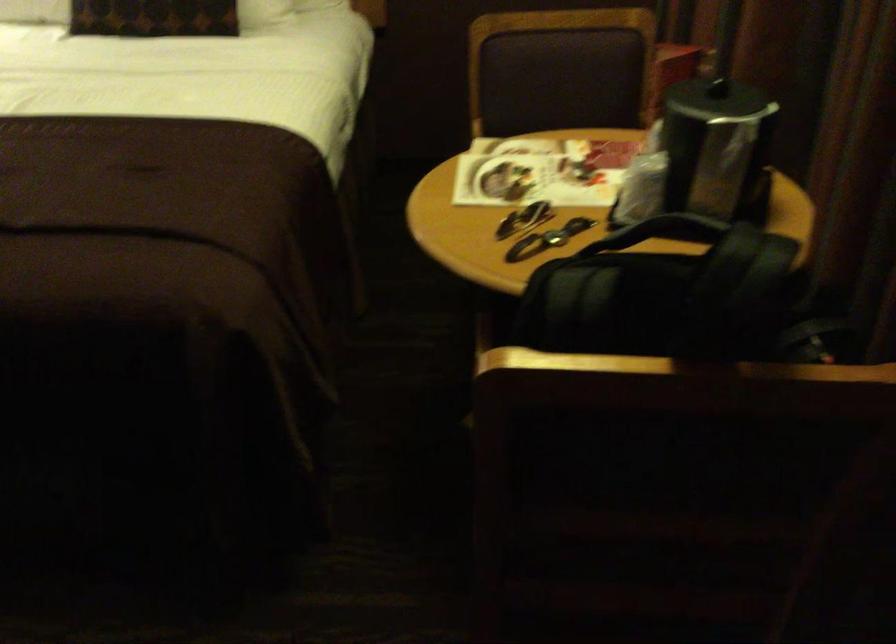
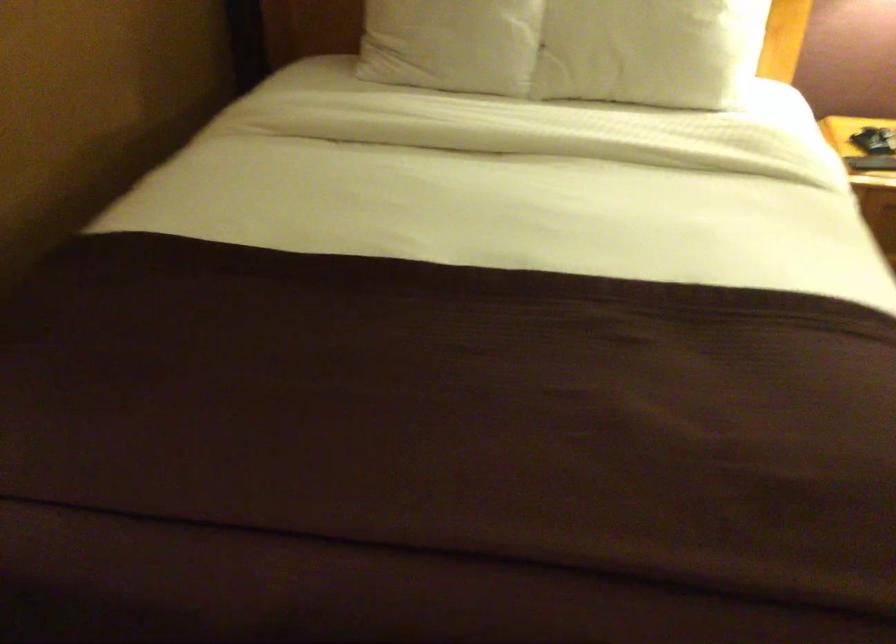
Question: In a continuous first-person perspective shot, in which direction is the camera moving?

Choices:
 (A) Left
 (B) Right
 (C) Forward
 (D) Backward

Answer: (A)